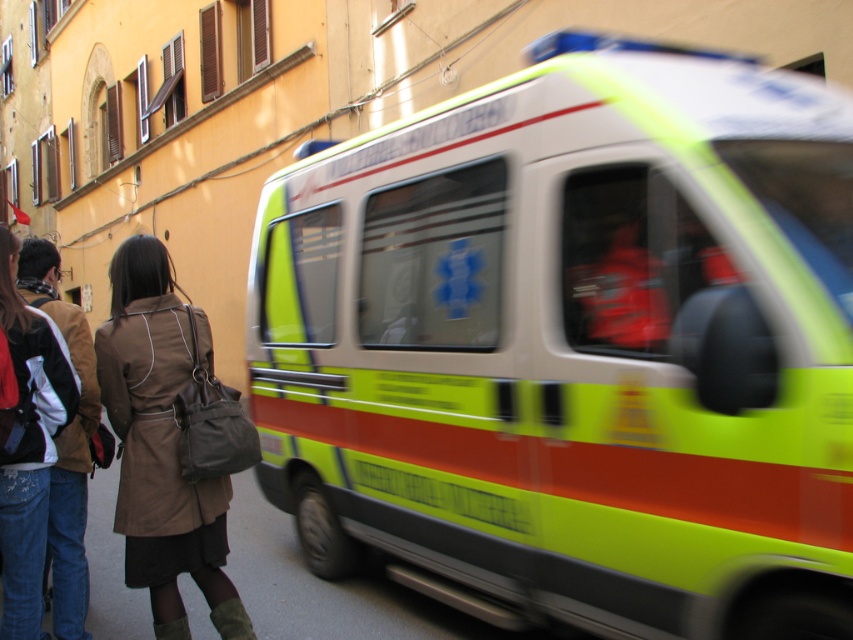
You are standing at the point with coordinates point (32, 486) and want to walk to the ambulance. Which direction should you go to avoid the person at point (154, 433)?

Point (154, 433) is in front of point (32, 486). To reach the ambulance while avoiding the person at point (154, 433), you should move behind them by going in the opposite direction away from the ambulance temporarily before proceeding around.